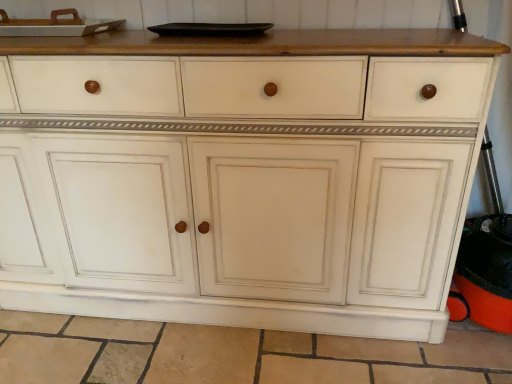
Describe the element at coordinates (234, 354) in the screenshot. Image resolution: width=512 pixels, height=384 pixels. I see `beige stone tile at lower center` at that location.

This screenshot has height=384, width=512. In order to click on beige stone tile at lower center in this screenshot , I will do `click(234, 354)`.

Where is `beige stone tile at lower center`? beige stone tile at lower center is located at coordinates (234, 354).